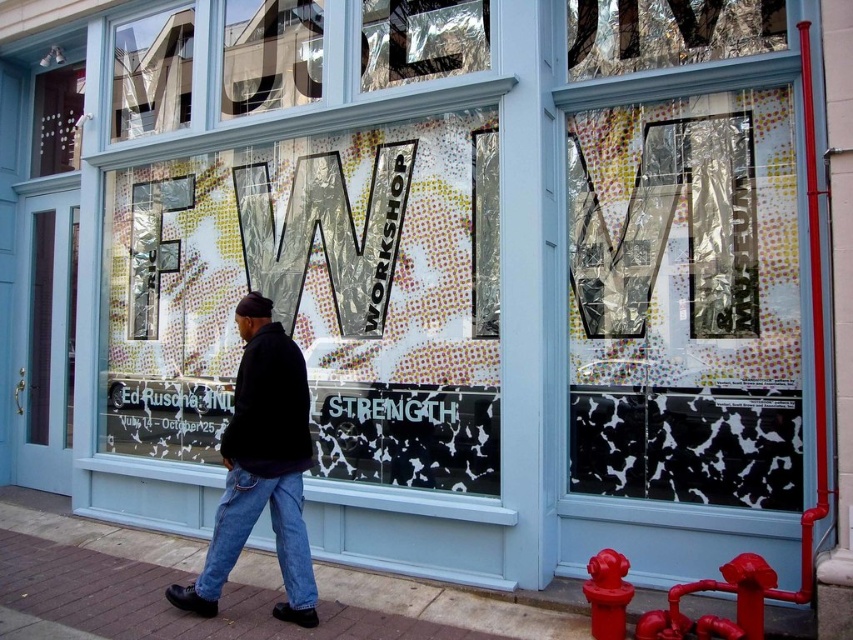
Question: Is metallic reflective foil at upper center behind shiny red fire hydrant at lower right?

Choices:
 (A) yes
 (B) no

Answer: (A)

Question: Which of the following is the closest to the observer?

Choices:
 (A) (154, 120)
 (B) (424, 20)
 (C) (222, 508)
 (D) (270, 17)

Answer: (C)

Question: Which object is closer to the camera taking this photo?

Choices:
 (A) black cotton jacket at lower left
 (B) shiny red fire hydrant at lower right
 (C) metallic reflective glass at upper left

Answer: (B)

Question: Can you confirm if metallic reflective foil at upper center is thinner than transparent plastic letter at upper left?

Choices:
 (A) no
 (B) yes

Answer: (A)

Question: Which object is the farthest from the transparent plastic letter at upper left?

Choices:
 (A) brick pavement at lower left
 (B) metallic mosaic sign at center

Answer: (A)

Question: Is metallic mosaic sign at center further to camera compared to shiny red fire hydrant at lower right?

Choices:
 (A) no
 (B) yes

Answer: (B)